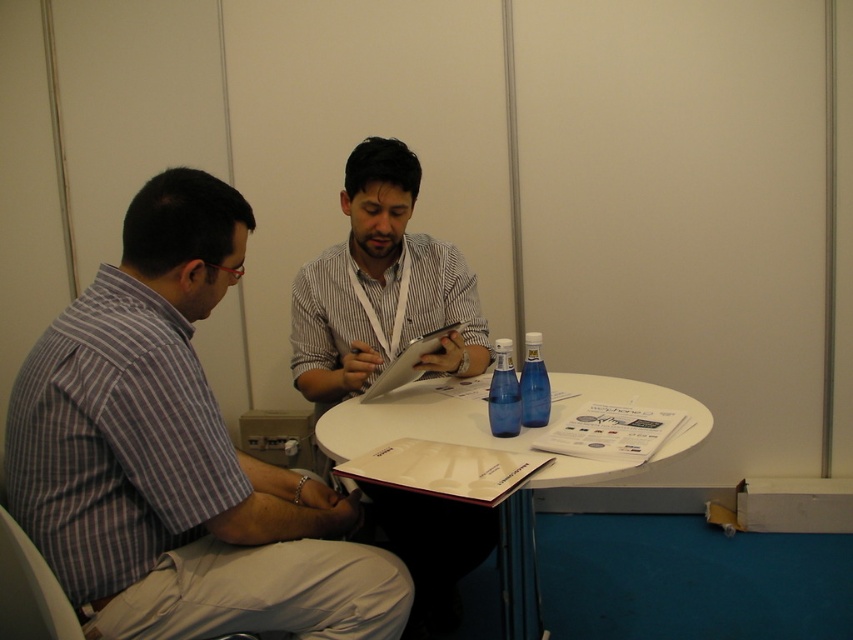
Consider the image. Is white plastic table at center below white paper clipboard at center?

Indeed, white plastic table at center is positioned under white paper clipboard at center.

Can you confirm if white plastic table at center is positioned to the right of white paper clipboard at center?

Correct, you'll find white plastic table at center to the right of white paper clipboard at center.

Which is in front, point (436, 404) or point (418, 340)?

Point (418, 340)

Locate an element on the screen. Image resolution: width=853 pixels, height=640 pixels. white plastic table at center is located at coordinates (410, 422).

Is point (494, 397) positioned in front of point (532, 403)?

Yes, point (494, 397) is closer to viewer.

How far apart are blue plastic bottle at center and blue glass bottle at center?

blue plastic bottle at center and blue glass bottle at center are 5.09 centimeters apart.

Which is behind, point (496, 419) or point (532, 394)?

Positioned behind is point (532, 394).

The image size is (853, 640). I want to click on blue plastic bottle at center, so click(503, 394).

Is striped cotton shirt at left behind white paper clipboard at center?

No.

The image size is (853, 640). Describe the element at coordinates (177, 456) in the screenshot. I see `striped cotton shirt at left` at that location.

Measure the distance between striped cotton shirt at left and camera.

3.60 feet

At what (x,y) coordinates should I click in order to perform the action: click on striped cotton shirt at left. Please return your answer as a coordinate pair (x, y). The width and height of the screenshot is (853, 640). Looking at the image, I should click on click(x=177, y=456).